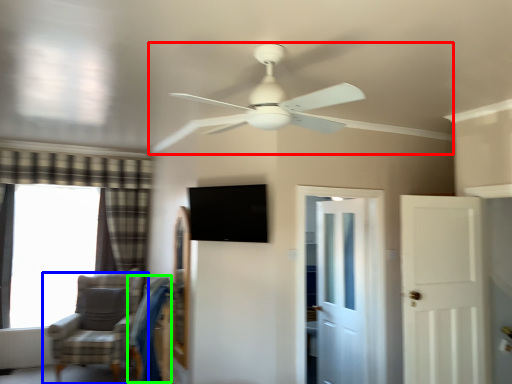
Question: Based on their relative distances, which object is farther from ceiling fan (highlighted by a red box)? Choose from chair (highlighted by a blue box) and swivel chair (highlighted by a green box).

Choices:
 (A) chair
 (B) swivel chair

Answer: (A)